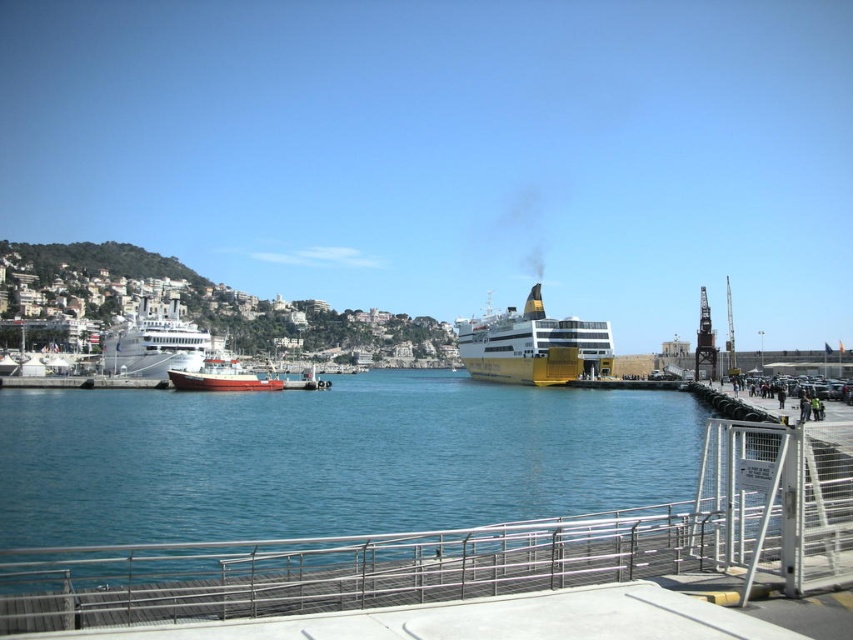
You are a tour guide on a pier and want to show visitors the distance between the yellow matte cruise ship at center and the red matte boat at center. How far apart are they?

The yellow matte cruise ship at center and the red matte boat at center are 133.48 feet apart.

You are a dock worker who needs to ensure that the white glossy cruise ship at left and the red matte boat at center can both fit through a narrow channel that is 10 meters wide. Based on their widths, can both vessels pass through the channel simultaneously without overlapping?

The white glossy cruise ship at left might be wider than red matte boat at center. Since the channel is only 10 meters wide, it is uncertain if both can pass simultaneously without overlapping. Further information about their exact widths is needed to determine feasibility.

You are standing on the pier and want to board the white glossy cruise ship at left. The walkway has a 100 meter limit for boarding. Can you reach the ship within the limit?

The distance between you and the white glossy cruise ship at left is 108.97 meters, which exceeds the 100 meter limit. Therefore, you cannot board the ship within the allowed distance.